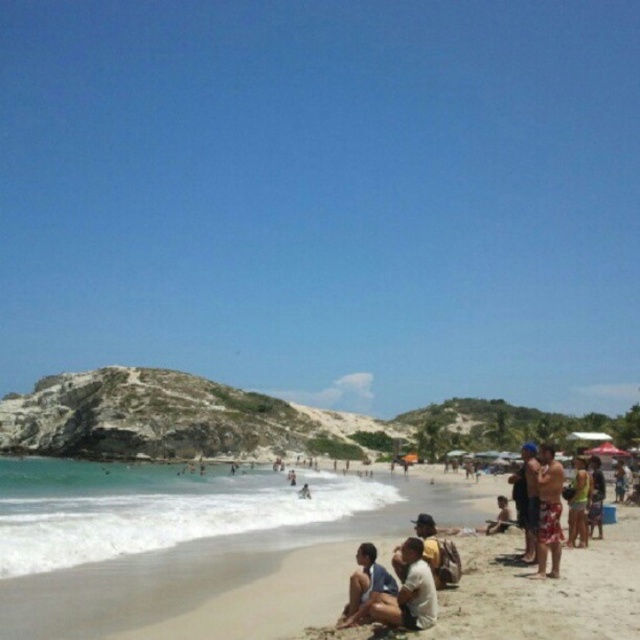
You are standing on the beach and see two points marked in the image. The first point is at coordinates point (372, 564) and the second point is at point (595, 502). Which point is closer to you?

Point (372, 564) is in front of point (595, 502), so the first point is closer to you.

You are standing at the camera position and want to throw a frisbee to someone wearing the matte white shirt at lower center. If the frisbee can travel 40 meters, will it reach them?

The matte white shirt at lower center is 43.97 meters from camera, so the frisbee cannot reach them as it can only travel 40 meters.

You are a photographer trying to capture a candid shot of the beach scene. You notice the matte white shirt at lower center and the tan fabric shorts at lower right. Which object would require a wider angle to fully capture in your photo?

The tan fabric shorts at lower right would require a wider angle because it occupies more space than the matte white shirt at lower center.